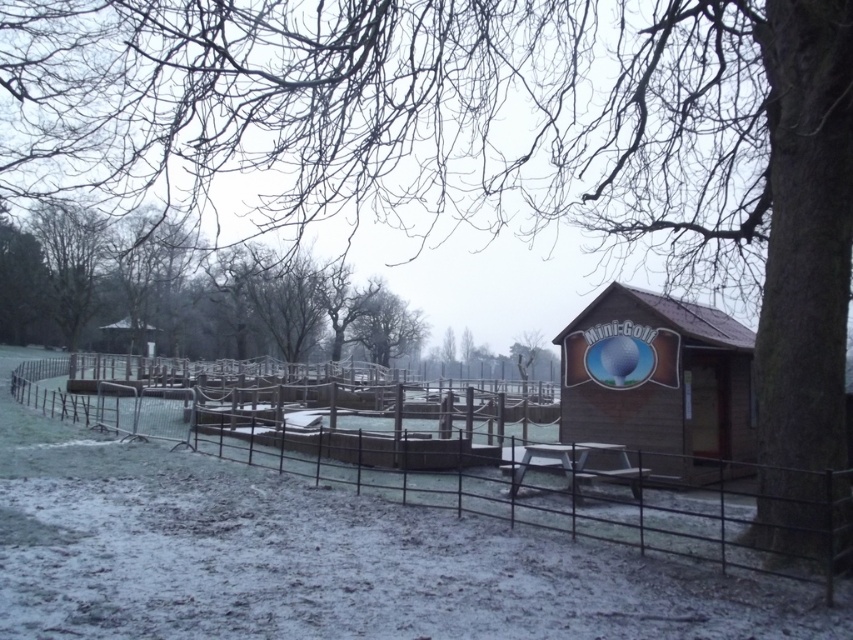
Question: Which object appears closest to the camera in this image?

Choices:
 (A) wooden fence at center
 (B) wooden hut at center

Answer: (A)

Question: Which point is closer to the camera?

Choices:
 (A) bare wood fence at left
 (B) wooden hut at center

Answer: (B)

Question: Is wooden fence at center below wooden hut at center?

Choices:
 (A) yes
 (B) no

Answer: (A)

Question: Where is bare wood fence at left located in relation to wooden hut at center in the image?

Choices:
 (A) above
 (B) below

Answer: (A)

Question: Does wooden fence at center have a larger size compared to wooden hut at center?

Choices:
 (A) no
 (B) yes

Answer: (B)

Question: Which point is farther from the camera taking this photo?

Choices:
 (A) (650, 522)
 (B) (335, 358)

Answer: (B)